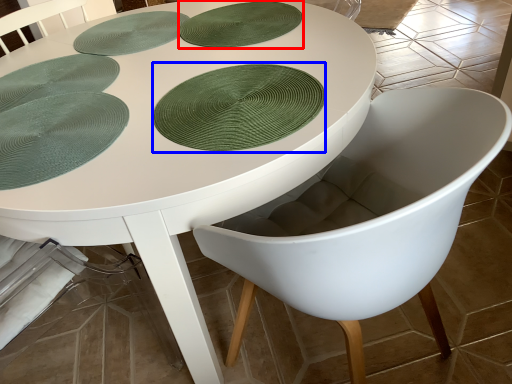
Question: Which object is closer to the camera taking this photo, paper plate (highlighted by a red box) or paper plate (highlighted by a blue box)?

Choices:
 (A) paper plate
 (B) paper plate

Answer: (B)